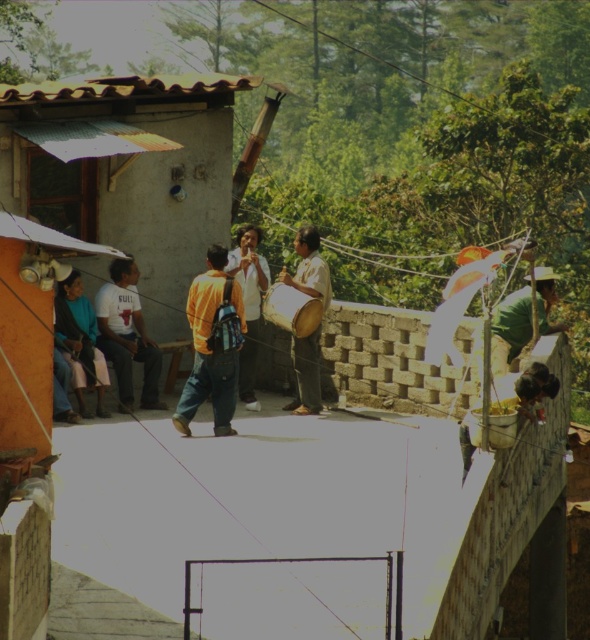
You are organizing a rooftop event and need to ensure that the blue fabric jacket at lower left and the yellow fabric shirt at center can fit side by side on a display rack. The rack has a maximum width capacity of 1.2 meters. Given their sizes, will they both fit together?

The blue fabric jacket at lower left has a larger width than the yellow fabric shirt at center. However, without knowing the exact combined width of both items, we cannot determine if they will fit on the rack. Additional measurements are needed to confirm.

You are a photographer planning to take a group photo of the wooden drum at center and yellow fabric shirt at center. Considering their sizes, which object should you focus on to ensure both are clearly visible in the photo?

The wooden drum at center has a larger size compared to the yellow fabric shirt at center. To ensure both are clearly visible, focus on the wooden drum at center as it requires more space due to its larger size.

You are a photographer trying to capture a clear photo of the yellow fabric shirt at center without the orange matte backpack at center blocking it. What should you do?

Move the camera position to the side so the orange matte backpack at center is no longer in front of the yellow fabric shirt at center. Since the orange matte backpack at center is currently in front of the yellow fabric shirt at center, shifting the angle will allow the yellow fabric shirt at center to be visible without obstruction.